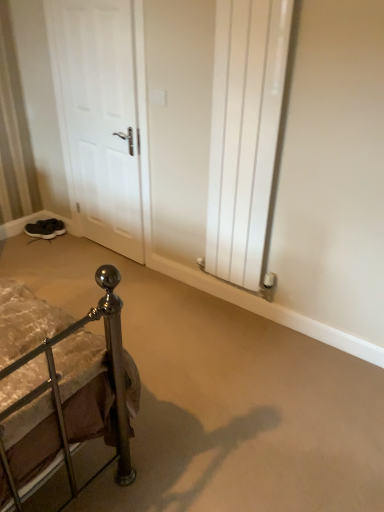
Question: From the image's perspective, would you say white matte door at left is shown under dark gray suede sneakers at lower left, the 1th footwear in the front-to-back sequence?

Choices:
 (A) no
 (B) yes

Answer: (A)

Question: From a real-world perspective, is white matte door at left over dark gray suede sneakers at lower left, which appears as the 2th footwear when viewed from the back?

Choices:
 (A) no
 (B) yes

Answer: (B)

Question: Is white matte door at left smaller than dark gray suede sneakers at lower left, the 1th footwear in the front-to-back sequence?

Choices:
 (A) no
 (B) yes

Answer: (A)

Question: Does white matte door at left have a lesser width compared to dark gray suede sneakers at lower left, which appears as the 2th footwear when viewed from the back?

Choices:
 (A) no
 (B) yes

Answer: (B)

Question: From a real-world perspective, is white matte door at left under dark gray suede sneakers at lower left, which appears as the 2th footwear when viewed from the back?

Choices:
 (A) no
 (B) yes

Answer: (A)

Question: Is the surface of white matte door at left in direct contact with dark gray suede sneakers at lower left, the 1th footwear in the front-to-back sequence?

Choices:
 (A) yes
 (B) no

Answer: (B)

Question: Can you confirm if white matte door at left is positioned to the right of white glossy radiator at center right?

Choices:
 (A) no
 (B) yes

Answer: (A)

Question: Is white glossy radiator at center right at the back of white matte door at left?

Choices:
 (A) no
 (B) yes

Answer: (A)

Question: Is the position of white matte door at left more distant than that of white glossy radiator at center right?

Choices:
 (A) no
 (B) yes

Answer: (B)

Question: Does white matte door at left contain white glossy radiator at center right?

Choices:
 (A) no
 (B) yes

Answer: (A)

Question: From the image's perspective, would you say white matte door at left is shown under white glossy radiator at center right?

Choices:
 (A) yes
 (B) no

Answer: (B)

Question: From a real-world perspective, is white matte door at left over white glossy radiator at center right?

Choices:
 (A) yes
 (B) no

Answer: (B)

Question: Is dark gray suede sneakers at lower left, which appears as the 2th footwear when viewed from the back, positioned far away from white matte door at left?

Choices:
 (A) no
 (B) yes

Answer: (A)